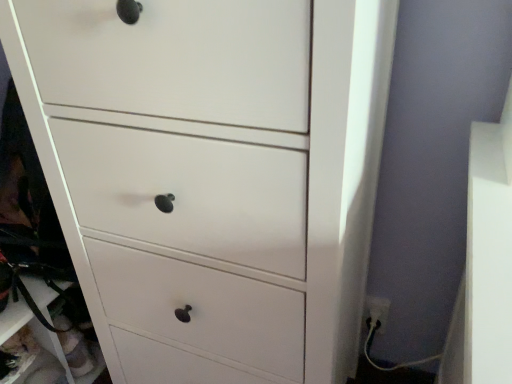
Describe the element at coordinates (25, 324) in the screenshot. I see `matte white shelf at lower left` at that location.

Identify the location of matte white shelf at lower left. The width and height of the screenshot is (512, 384). (25, 324).

Find the location of a particular element. This screenshot has height=384, width=512. matte white shelf at lower left is located at coordinates (25, 324).